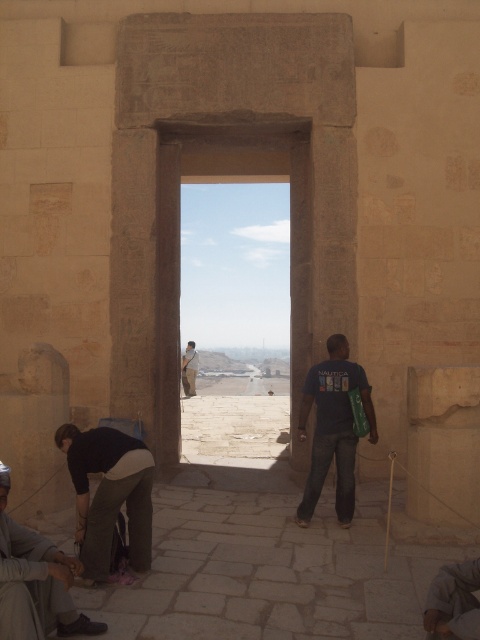
Can you confirm if dark gray fabric shoe at lower left is wider than dark blue t-shirt at center?

In fact, dark gray fabric shoe at lower left might be narrower than dark blue t-shirt at center.

Can you confirm if dark gray fabric shoe at lower left is bigger than dark blue t-shirt at center?

No.

Where is `dark gray fabric shoe at lower left`? dark gray fabric shoe at lower left is located at coordinates (35, 582).

In order to click on dark gray fabric shoe at lower left in this screenshot , I will do `click(35, 582)`.

Is dark gray pants at lower left further to camera compared to dark gray fabric shoe at lower left?

Yes, dark gray pants at lower left is further from the viewer.

The width and height of the screenshot is (480, 640). I want to click on dark gray pants at lower left, so click(x=108, y=493).

Does dark gray fabric shoe at lower left have a lesser height compared to light brown fabric at center?

Incorrect, dark gray fabric shoe at lower left's height does not fall short of light brown fabric at center's.

Looking at this image, can you confirm if dark gray fabric shoe at lower left is bigger than light brown fabric at center?

Indeed, dark gray fabric shoe at lower left has a larger size compared to light brown fabric at center.

The height and width of the screenshot is (640, 480). In order to click on dark gray fabric shoe at lower left in this screenshot , I will do `click(35, 582)`.